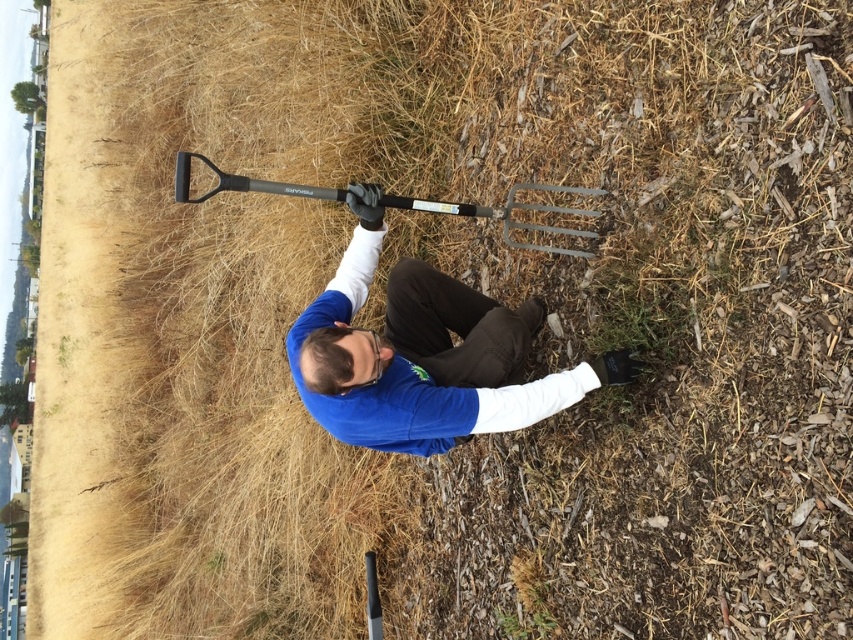
Based on the photo, you are a gardener who needs to locate your matte black pitchfork at center. Based on the coordinates provided, where would you find it in the image?

The matte black pitchfork at center is located at point coordinates (424,355), so you would find it there in the image.

You are a gardener who needs to choose a tool to dig up some stubborn weeds. You see the matte black pitchfork at center and the black plastic shovel at upper center. Which tool is taller and would be better for reaching deeper roots?

The matte black pitchfork at center is taller than the black plastic shovel at upper center, making it better for reaching deeper roots.